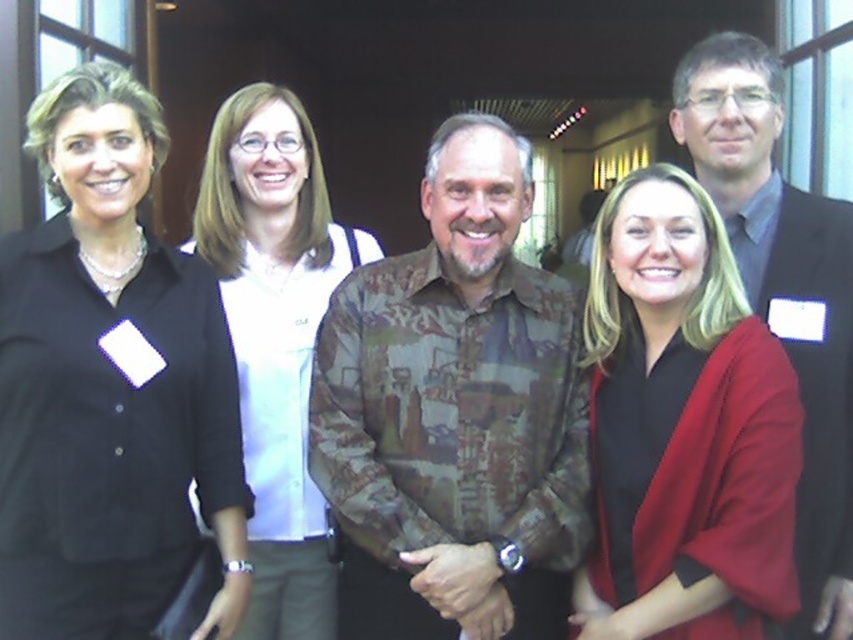
Does matte black blazer at center have a greater width compared to white matte shirt at center?

In fact, matte black blazer at center might be narrower than white matte shirt at center.

Between matte black blazer at center and white matte shirt at center, which one has more height?

white matte shirt at center is taller.

Which is in front, point (601, 416) or point (335, 592)?

Point (601, 416)

I want to click on matte black blazer at center, so click(x=685, y=422).

Is point (271, 102) positioned behind point (817, 618)?

Yes, it is.

Does point (209, 250) come in front of point (770, 204)?

No.

Image resolution: width=853 pixels, height=640 pixels. I want to click on white matte shirt at center, so click(x=276, y=337).

Is the position of black shirt at left more distant than that of dark gray suit at right?

That is False.

Who is positioned more to the right, black shirt at left or dark gray suit at right?

dark gray suit at right

Does point (3, 605) come farther from viewer compared to point (755, 64)?

No.

Image resolution: width=853 pixels, height=640 pixels. Identify the location of black shirt at left. (109, 387).